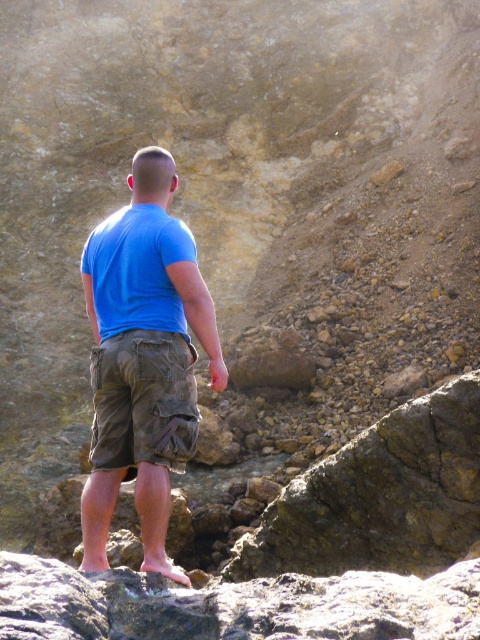
You are a drone operator tasked with capturing aerial footage of the rocky terrain. The camera is positioned at a certain height. There is a specific point marked at coordinates point (191,323) that needs to be in focus. What is the minimum distance the drone must maintain from the camera to ensure this point remains in focus?

The minimum distance the drone must maintain from the camera to keep point (191,323) in focus is 4.60 meters, as the point is 4.60 meters away from the camera.

You are navigating through the rocky terrain and need to place a marker at the point closer to you. Which point should you choose between point (131, 234) and point (163, 396)?

Point (131, 234) is closer to you than point (163, 396), so you should choose point (131, 234) for placing the marker.